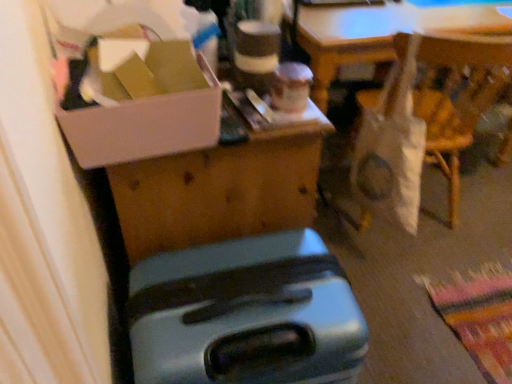
Question: Is the position of white cardboard box at upper left more distant than that of metallic suitcase at lower center?

Choices:
 (A) yes
 (B) no

Answer: (A)

Question: Is white cardboard box at upper left taller than metallic suitcase at lower center?

Choices:
 (A) yes
 (B) no

Answer: (B)

Question: Is white cardboard box at upper left positioned in front of metallic suitcase at lower center?

Choices:
 (A) no
 (B) yes

Answer: (A)

Question: From a real-world perspective, does white cardboard box at upper left sit lower than metallic suitcase at lower center?

Choices:
 (A) yes
 (B) no

Answer: (B)

Question: Is white cardboard box at upper left to the left of metallic suitcase at lower center from the viewer's perspective?

Choices:
 (A) yes
 (B) no

Answer: (A)

Question: Looking at their shapes, would you say white cardboard box at upper left is wider or thinner than white fabric bag at right?

Choices:
 (A) wide
 (B) thin

Answer: (A)

Question: From a real-world perspective, is white cardboard box at upper left physically located above or below white fabric bag at right?

Choices:
 (A) below
 (B) above

Answer: (B)

Question: Considering their positions, is white cardboard box at upper left located in front of or behind white fabric bag at right?

Choices:
 (A) front
 (B) behind

Answer: (A)

Question: Is white cardboard box at upper left inside or outside of white fabric bag at right?

Choices:
 (A) inside
 (B) outside

Answer: (B)

Question: Relative to metallic suitcase at lower center, is white fabric bag at right in front or behind?

Choices:
 (A) behind
 (B) front

Answer: (A)

Question: From the image's perspective, relative to metallic suitcase at lower center, is white fabric bag at right above or below?

Choices:
 (A) above
 (B) below

Answer: (A)

Question: Is point (373, 177) closer or farther from the camera than point (264, 289)?

Choices:
 (A) closer
 (B) farther

Answer: (B)

Question: Is white fabric bag at right to the left or to the right of metallic suitcase at lower center in the image?

Choices:
 (A) right
 (B) left

Answer: (A)

Question: From a real-world perspective, is white cardboard box at upper left above or below metallic suitcase at lower center?

Choices:
 (A) below
 (B) above

Answer: (B)

Question: From the image's perspective, is white cardboard box at upper left above or below metallic suitcase at lower center?

Choices:
 (A) below
 (B) above

Answer: (B)